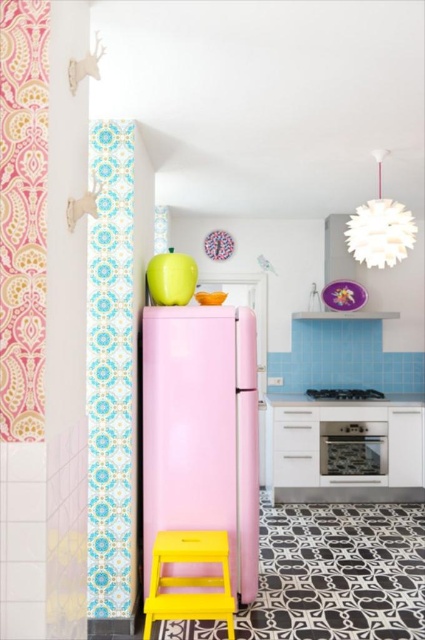
Is glossy pink refrigerator at center to the right of metallic silver stove at center from the viewer's perspective?

No, glossy pink refrigerator at center is not to the right of metallic silver stove at center.

Where is `glossy pink refrigerator at center`? This screenshot has width=425, height=640. glossy pink refrigerator at center is located at coordinates (201, 432).

Is yellow plastic stool at lower left behind metallic silver stove at center?

That is False.

Who is more forward, (204,595) or (374,394)?

Point (204,595) is more forward.

Locate an element on the screen. The height and width of the screenshot is (640, 425). yellow plastic stool at lower left is located at coordinates (189, 579).

Which of these two, glossy pink refrigerator at center or pink fabric curtain at left, stands shorter?

With less height is pink fabric curtain at left.

Does glossy pink refrigerator at center appear under pink fabric curtain at left?

Indeed, glossy pink refrigerator at center is positioned under pink fabric curtain at left.

This screenshot has width=425, height=640. What do you see at coordinates (201, 432) in the screenshot?
I see `glossy pink refrigerator at center` at bounding box center [201, 432].

The height and width of the screenshot is (640, 425). What are the coordinates of `glossy pink refrigerator at center` in the screenshot? It's located at (201, 432).